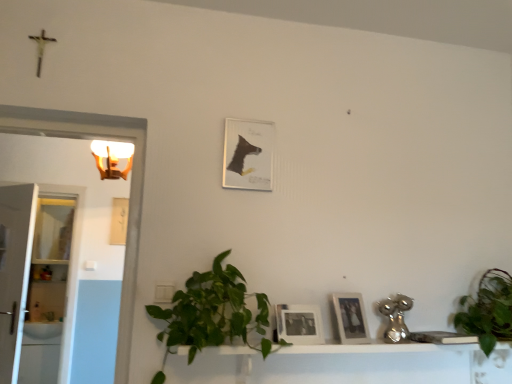
Question: Could you tell me if matte black photo frame at center, the first picture frame from the front, is facing white glossy light fixture at upper left?

Choices:
 (A) no
 (B) yes

Answer: (A)

Question: Is matte black photo frame at center, which appears as the 3th picture frame when viewed from the left, surrounding white glossy light fixture at upper left?

Choices:
 (A) no
 (B) yes

Answer: (A)

Question: From the image's perspective, is matte black photo frame at center, placed as the first picture frame when sorted from bottom to top, located beneath white glossy light fixture at upper left?

Choices:
 (A) yes
 (B) no

Answer: (A)

Question: From the image's perspective, is matte black photo frame at center, the fourth picture frame in the top-to-bottom sequence, above white glossy light fixture at upper left?

Choices:
 (A) no
 (B) yes

Answer: (A)

Question: Is matte black photo frame at center, the first picture frame from the front, looking in the opposite direction of white glossy light fixture at upper left?

Choices:
 (A) yes
 (B) no

Answer: (B)

Question: Does point (339, 309) appear closer or farther from the camera than point (108, 145)?

Choices:
 (A) farther
 (B) closer

Answer: (B)

Question: Considering their positions, is wooden photo frame at lower center, arranged as the third picture frame when viewed from the back, located in front of or behind white glossy light fixture at upper left?

Choices:
 (A) behind
 (B) front

Answer: (B)

Question: In terms of height, does wooden photo frame at lower center, placed as the 1th picture frame when sorted from right to left, look taller or shorter compared to white glossy light fixture at upper left?

Choices:
 (A) tall
 (B) short

Answer: (B)

Question: Looking at their shapes, would you say wooden photo frame at lower center, arranged as the third picture frame when viewed from the back, is wider or thinner than white glossy light fixture at upper left?

Choices:
 (A) wide
 (B) thin

Answer: (B)

Question: From a real-world perspective, is wooden photo frame at lower center, arranged as the third picture frame when viewed from the back, above or below green leafy plant at lower center, which is counted as the 2th houseplant, starting from the right?

Choices:
 (A) above
 (B) below

Answer: (B)

Question: In terms of width, does wooden photo frame at lower center, which is the 2th picture frame in front-to-back order, look wider or thinner when compared to green leafy plant at lower center, which is counted as the 1th houseplant, starting from the left?

Choices:
 (A) wide
 (B) thin

Answer: (B)

Question: In the image, is wooden photo frame at lower center, arranged as the 3th picture frame when viewed from the top, positioned in front of or behind green leafy plant at lower center, which is counted as the 1th houseplant, starting from the left?

Choices:
 (A) front
 (B) behind

Answer: (B)

Question: Is wooden photo frame at lower center, the fourth picture frame positioned from the left, inside or outside of green leafy plant at lower center, which is counted as the 2th houseplant, starting from the right?

Choices:
 (A) inside
 (B) outside

Answer: (B)

Question: From a real-world perspective, relative to white glossy light fixture at upper left, is white glossy glass door at left, which is the second glass door from back to front, vertically above or below?

Choices:
 (A) below
 (B) above

Answer: (A)

Question: Is point (10, 372) closer or farther from the camera than point (96, 162)?

Choices:
 (A) closer
 (B) farther

Answer: (A)